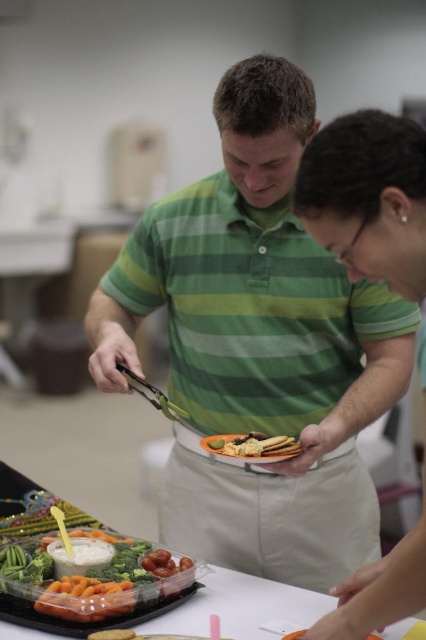
Question: Can you confirm if fresh green broccoli at lower left is positioned to the right of golden crispy fries at center?

Choices:
 (A) no
 (B) yes

Answer: (A)

Question: Which of the following is the closest to the observer?

Choices:
 (A) matte black plate at center
 (B) fresh green broccoli at lower left
 (C) green striped polo shirt at center
 (D) clear plastic tray at center

Answer: (A)

Question: Considering the relative positions of fresh green broccoli at lower left and clear plastic tray at center in the image provided, where is fresh green broccoli at lower left located with respect to clear plastic tray at center?

Choices:
 (A) above
 (B) below

Answer: (A)

Question: Which of the following is the closest to the observer?

Choices:
 (A) fresh green broccoli at lower left
 (B) golden crispy fries at center
 (C) matte black plate at center

Answer: (C)

Question: Does fresh green broccoli at lower left have a smaller size compared to golden crispy fries at center?

Choices:
 (A) no
 (B) yes

Answer: (A)

Question: Which point is closer to the camera?

Choices:
 (A) matte black plate at center
 (B) clear plastic tray at center
 (C) golden crispy fries at center

Answer: (A)